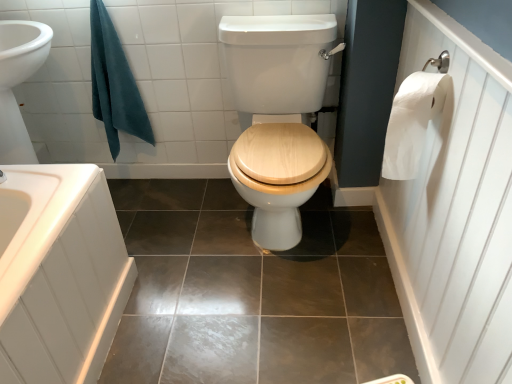
Locate an element on the screen. free space that is to the left of white wood toilet seat at center is located at coordinates (178, 231).